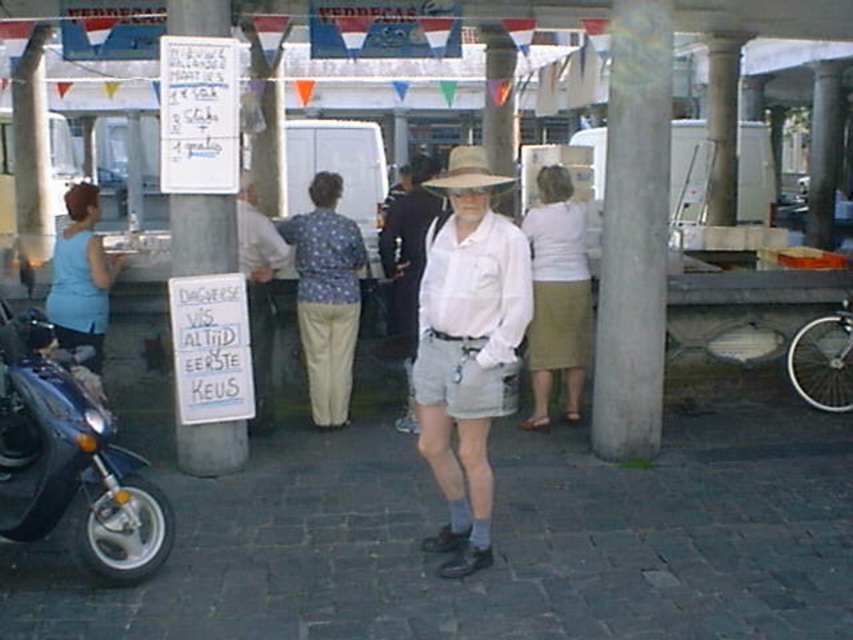
Question: Can you confirm if shiny blue scooter at lower left is positioned to the right of strawmaterial/texturehat at center?

Choices:
 (A) yes
 (B) no

Answer: (B)

Question: Which is nearer to the light beige cotton shorts at center?

Choices:
 (A) floral fabric blouse at center
 (B) strawmaterial/texturehat at center

Answer: (A)

Question: Does light beige cotton shorts at center have a greater width compared to strawmaterial/texturehat at center?

Choices:
 (A) no
 (B) yes

Answer: (A)

Question: Can you confirm if floral fabric blouse at center is positioned to the left of light beige skirt at center?

Choices:
 (A) no
 (B) yes

Answer: (B)

Question: Which point is farther to the camera?

Choices:
 (A) (264, 259)
 (B) (54, 458)

Answer: (A)

Question: Which point is closer to the camera taking this photo?

Choices:
 (A) (474, 152)
 (B) (80, 496)

Answer: (B)